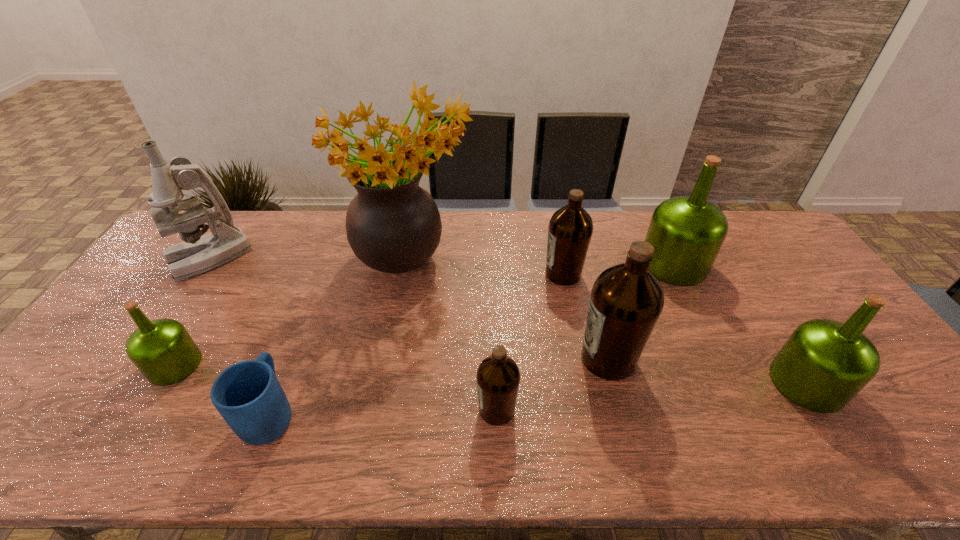
Locate an element on the screen. This screenshot has height=540, width=960. free spot between the gray microscope and the leftmost olive oil is located at coordinates (192, 312).

In order to click on the closest object to the smallest green olive oil in this screenshot , I will do `click(248, 395)`.

Locate an element on the screen. The height and width of the screenshot is (540, 960). object that is the second nearest to the sixth object from right to left is located at coordinates (248, 395).

Identify which olive oil is located as the third nearest to the second farthest brown olive oil. Please provide its 2D coordinates. Your answer should be formatted as a tuple, i.e. [(x, y)], where the tuple contains the x and y coordinates of a point satisfying the conditions above.

[(687, 232)]

You are a GUI agent. You are given a task and a screenshot of the screen. Output one action in this format:
    pyautogui.click(x=<x>, y=<y>)
    Task: Click on the olive oil identified as the third closest to the second smallest brown olive oil
    
    Given the screenshot: What is the action you would take?
    pyautogui.click(x=498, y=377)

Locate an element on the screen. This screenshot has height=540, width=960. green olive oil that stands as the second closest to the second smallest green olive oil is located at coordinates (162, 349).

Select which green olive oil is the closest to the leftmost green olive oil. Please provide its 2D coordinates. Your answer should be formatted as a tuple, i.e. [(x, y)], where the tuple contains the x and y coordinates of a point satisfying the conditions above.

[(687, 232)]

The image size is (960, 540). I want to click on brown olive oil that can be found as the second closest to the gray microscope, so click(570, 229).

Identify which brown olive oil is the third closest to the leftmost green olive oil. Please provide its 2D coordinates. Your answer should be formatted as a tuple, i.e. [(x, y)], where the tuple contains the x and y coordinates of a point satisfying the conditions above.

[(627, 299)]

Locate an element on the screen. The image size is (960, 540). free space that satisfies the following two spatial constraints: 1. on the back side of the farthest green olive oil; 2. on the right side of the leftmost olive oil is located at coordinates pos(237,264).